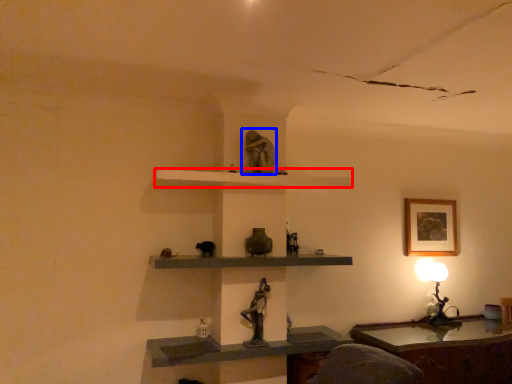
Question: Which point is closer to the camera, shelf (highlighted by a red box) or sculpture (highlighted by a blue box)?

Choices:
 (A) shelf
 (B) sculpture

Answer: (A)